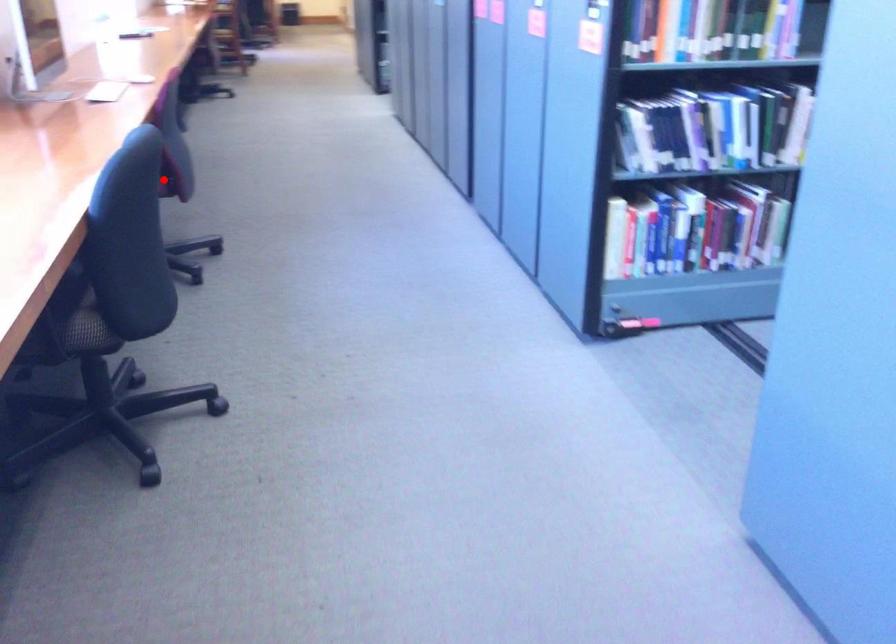
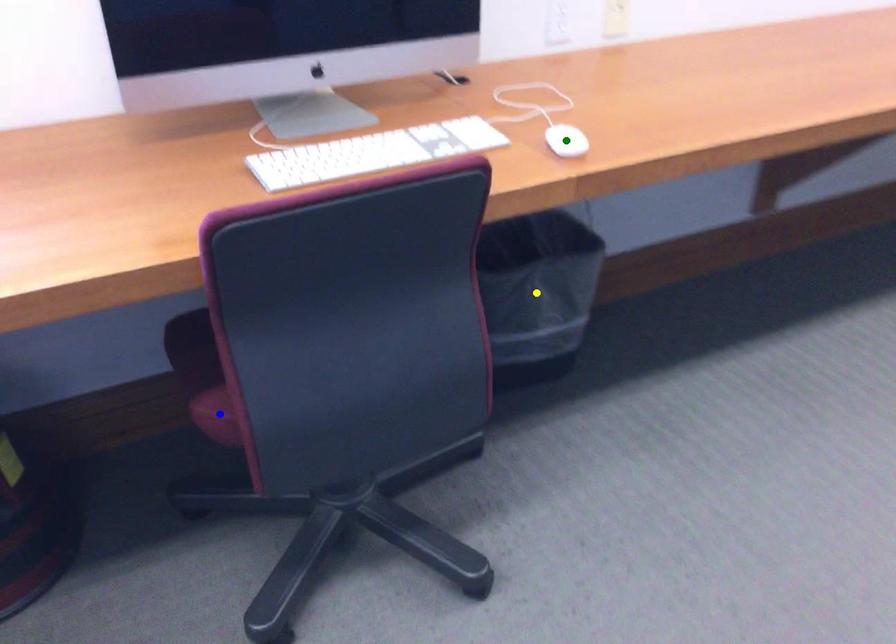
Question: I am providing you with two images of the same scene from different viewpoints. A red point is marked on the first image. You are given multiple points on the second image. Which point in image 2 represents the same 3d spot as the red point in image 1?

Choices:
 (A) blue point
 (B) yellow point
 (C) green point

Answer: (A)